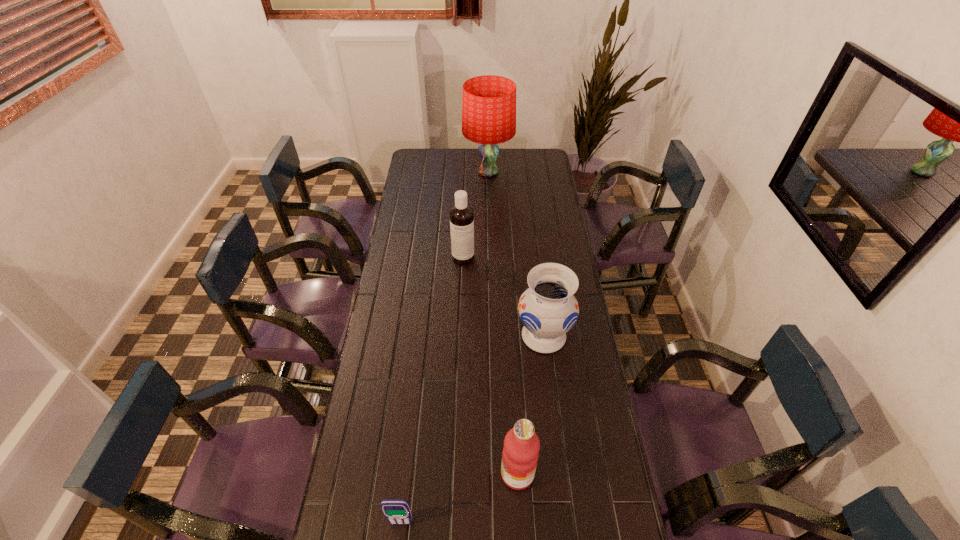
Locate an element on the screen. Image resolution: width=960 pixels, height=540 pixels. the third closest object to the lampshade is located at coordinates (521, 447).

You are a GUI agent. You are given a task and a screenshot of the screen. Output one action in this format:
    pyautogui.click(x=<x>, y=<y>)
    Task: Click on the object that is the second closest to the second nearest object
    Image resolution: width=960 pixels, height=540 pixels.
    Given the screenshot: What is the action you would take?
    pyautogui.click(x=548, y=309)

Locate an element on the screen. The height and width of the screenshot is (540, 960). free space that satisfies the following two spatial constraints: 1. on the label side of the vase; 2. on the right side of the second farthest object is located at coordinates (460, 336).

This screenshot has width=960, height=540. In order to click on vacant area in the image that satisfies the following two spatial constraints: 1. on the label side of the fourth nearest object; 2. on the right side of the vase in this screenshot , I will do `click(460, 336)`.

Locate an element on the screen. This screenshot has height=540, width=960. free space that satisfies the following two spatial constraints: 1. on the label of the fruit juice; 2. on the front-facing side of the cellular telephone is located at coordinates (520, 523).

You are a GUI agent. You are given a task and a screenshot of the screen. Output one action in this format:
    pyautogui.click(x=<x>, y=<y>)
    Task: Click on the vacant area that satisfies the following two spatial constraints: 1. on the front-facing side of the lampshade; 2. on the right side of the third farthest object
    
    Given the screenshot: What is the action you would take?
    pyautogui.click(x=492, y=336)

The height and width of the screenshot is (540, 960). I want to click on free space that satisfies the following two spatial constraints: 1. on the label side of the third farthest object; 2. on the left side of the second farthest object, so click(460, 336).